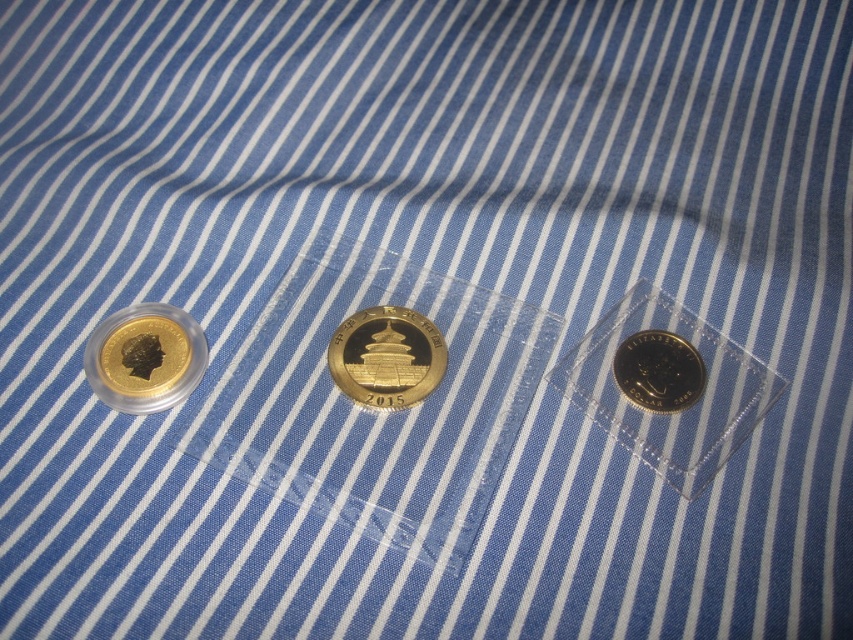
You are a photographer trying to capture the three coins on the striped fabric. You notice two points on the fabric background marked as point (109, 369) and point (691, 403). Which point should you focus on to ensure the closest object to the camera is in sharp focus?

Point (109, 369) is closer to the camera than point (691, 403), so focusing on point (109, 369) will ensure the closest object is in sharp focus.